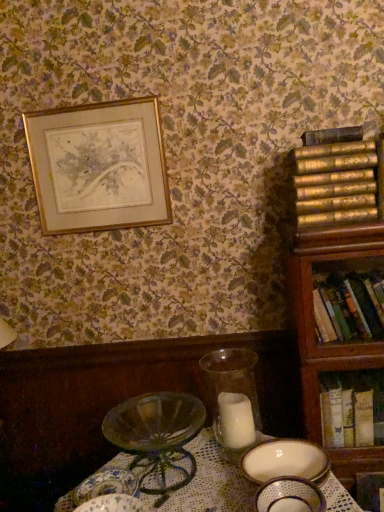
Question: Is porcelain plate at lower center, which ranks as the first tableware in left-to-right order, in front of or behind translucent glass candle at center in the image?

Choices:
 (A) front
 (B) behind

Answer: (A)

Question: Considering the positions of point (132, 495) and point (251, 415), is point (132, 495) closer or farther from the camera than point (251, 415)?

Choices:
 (A) farther
 (B) closer

Answer: (B)

Question: Which object is positioned closest to the porcelain bowl at lower center, the 1th tableware positioned from the right?

Choices:
 (A) hardcover book at right, the 2th book positioned from the bottom
 (B) translucent glass candle at center
 (C) gold textured books at right, the 3th book ordered from the bottom
 (D) wooden bookcase at right
 (E) white paper book at right, the 3th book viewed from the top

Answer: (E)

Question: Which is nearer to the porcelain bowl at lower center, which is the second tableware from left to right?

Choices:
 (A) gold textured books at right, the 3th book ordered from the bottom
 (B) porcelain plate at lower center, which is the second tableware in right-to-left order
 (C) white paper book at right, which is the first book from bottom to top
 (D) hardcover book at right, the 2th book positioned from the bottom
 (E) translucent glass candle at center

Answer: (B)